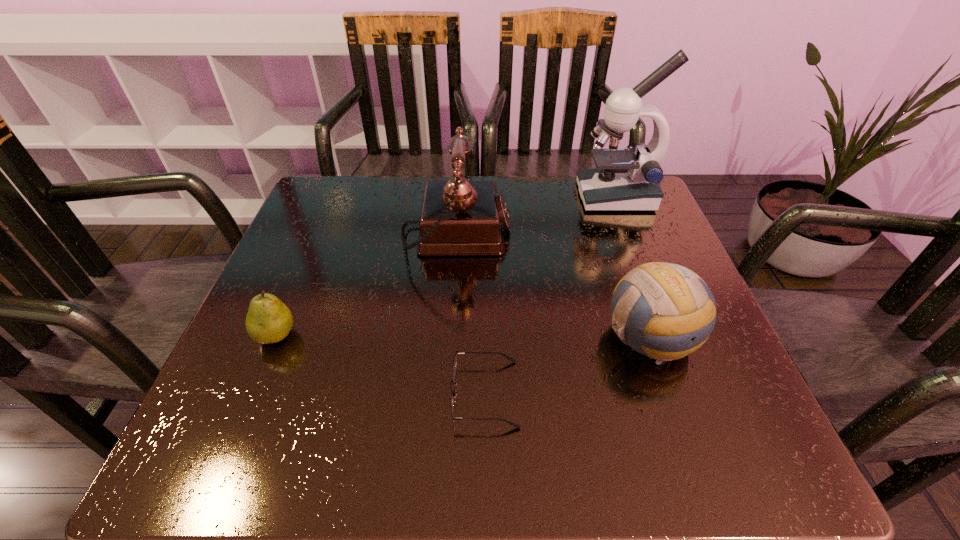
In order to click on vacant space located on the front-facing side of the shortest object in this screenshot , I will do `click(390, 393)`.

At what (x,y) coordinates should I click in order to perform the action: click on vacant space located on the front-facing side of the shortest object. Please return your answer as a coordinate pair (x, y). This screenshot has width=960, height=540. Looking at the image, I should click on (274, 393).

You are a GUI agent. You are given a task and a screenshot of the screen. Output one action in this format:
    pyautogui.click(x=<x>, y=<y>)
    Task: Click on the free space located on the front-facing side of the shortest object
    
    Given the screenshot: What is the action you would take?
    pyautogui.click(x=353, y=393)

You are a GUI agent. You are given a task and a screenshot of the screen. Output one action in this format:
    pyautogui.click(x=<x>, y=<y>)
    Task: Click on the microscope situated at the far edge
    The height and width of the screenshot is (540, 960).
    Given the screenshot: What is the action you would take?
    pyautogui.click(x=624, y=179)

You are a GUI agent. You are given a task and a screenshot of the screen. Output one action in this format:
    pyautogui.click(x=<x>, y=<y>)
    Task: Click on the telephone positioned at the far edge
    The width and height of the screenshot is (960, 540).
    Given the screenshot: What is the action you would take?
    (459, 217)

This screenshot has width=960, height=540. In order to click on object located in the near edge section of the desktop in this screenshot , I will do `click(457, 352)`.

Identify the location of object that is at the left edge. The width and height of the screenshot is (960, 540). (269, 320).

Image resolution: width=960 pixels, height=540 pixels. Identify the location of microscope located in the right edge section of the desktop. (624, 179).

Locate an element on the screen. This screenshot has height=540, width=960. volleyball that is positioned at the right edge is located at coordinates (665, 311).

Image resolution: width=960 pixels, height=540 pixels. Find the location of `object that is at the far right corner`. object that is at the far right corner is located at coordinates (624, 179).